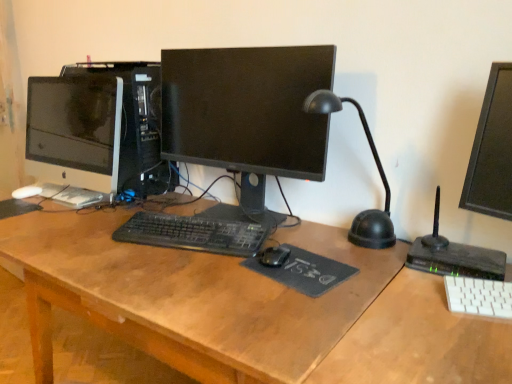
Identify the location of vacant area that is in front of black matte mouse at center. This screenshot has height=384, width=512. (272, 295).